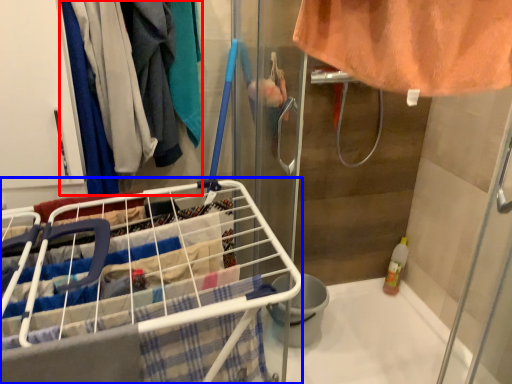
Question: Which of the following is the closest to the observer, clothing (highlighted by a red box) or shopping cart (highlighted by a blue box)?

Choices:
 (A) clothing
 (B) shopping cart

Answer: (B)